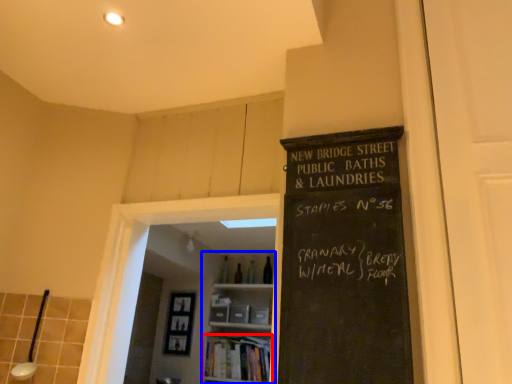
Question: Among these objects, which one is farthest to the camera, book (highlighted by a red box) or bookshelf (highlighted by a blue box)?

Choices:
 (A) book
 (B) bookshelf

Answer: (B)